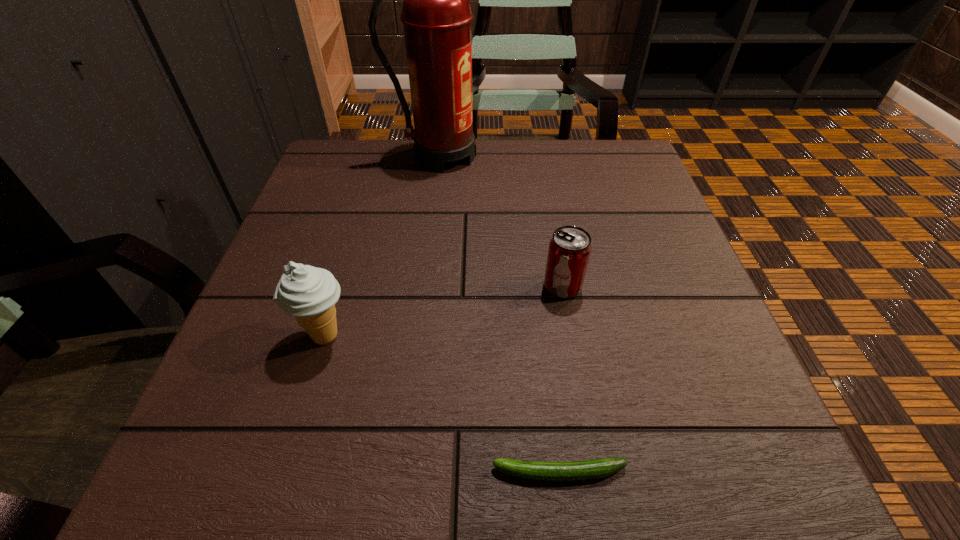
Identify the location of vacant space that's between the icecream and the shortest object. (442, 404).

Identify the location of free space between the zucchini and the fire extinguisher. (500, 314).

Where is `object that can be found as the second closest to the shortest object`? The width and height of the screenshot is (960, 540). object that can be found as the second closest to the shortest object is located at coordinates (569, 251).

Image resolution: width=960 pixels, height=540 pixels. I want to click on object that is the nearest to the fire extinguisher, so click(x=569, y=251).

You are a GUI agent. You are given a task and a screenshot of the screen. Output one action in this format:
    pyautogui.click(x=<x>, y=<y>)
    Task: Click on the free spot that satisfies the following two spatial constraints: 1. on the back side of the third farthest object; 2. on the right side of the third tallest object
    Image resolution: width=960 pixels, height=540 pixels.
    Given the screenshot: What is the action you would take?
    pyautogui.click(x=340, y=286)

At what (x,y) coordinates should I click in order to perform the action: click on free point that satisfies the following two spatial constraints: 1. on the front-facing side of the fire extinguisher; 2. on the front side of the icecream. Please return your answer as a coordinate pair (x, y). The width and height of the screenshot is (960, 540). Looking at the image, I should click on (421, 335).

At what (x,y) coordinates should I click in order to perform the action: click on vacant area in the image that satisfies the following two spatial constraints: 1. on the back side of the third nearest object; 2. on the front-facing side of the fire extinguisher. Please return your answer as a coordinate pair (x, y). Image resolution: width=960 pixels, height=540 pixels. Looking at the image, I should click on (540, 156).

What are the coordinates of `blank space that satisfies the following two spatial constraints: 1. on the back side of the pop soda; 2. on the front-facing side of the tallest object` in the screenshot? It's located at (540, 156).

Identify the location of free location that satisfies the following two spatial constraints: 1. on the front-facing side of the farthest object; 2. on the front side of the second nearest object. (421, 335).

This screenshot has width=960, height=540. What are the coordinates of `free space that satisfies the following two spatial constraints: 1. on the front-facing side of the tallest object; 2. on the back side of the pop soda` in the screenshot? It's located at (427, 286).